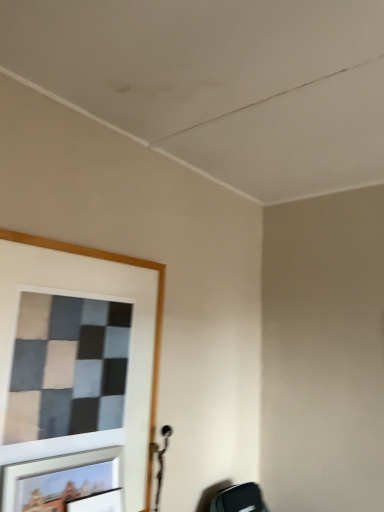
What do you see at coordinates (98, 502) in the screenshot? I see `matte black picture frame at lower left, which is counted as the 1th picture frame, starting from the bottom` at bounding box center [98, 502].

At what (x,y) coordinates should I click in order to perform the action: click on matte black picture frame at lower left, which is the second picture frame in top-to-bottom order. Please return your answer as a coordinate pair (x, y). Looking at the image, I should click on (98, 502).

This screenshot has width=384, height=512. Describe the element at coordinates (60, 480) in the screenshot. I see `metallic silver picture frame at lower left, marked as the 1th picture frame in a top-to-bottom arrangement` at that location.

What are the coordinates of `metallic silver picture frame at lower left, which is the second picture frame in bottom-to-top order` in the screenshot? It's located at (60, 480).

Locate an element on the screen. matte black picture frame at lower left, which is counted as the 1th picture frame, starting from the bottom is located at coordinates (x=98, y=502).

Is metallic silver picture frame at lower left, which is the second picture frame in bottom-to-top order, at the left side of matte black picture frame at lower left, which is the second picture frame in top-to-bottom order?

Indeed, metallic silver picture frame at lower left, which is the second picture frame in bottom-to-top order, is positioned on the left side of matte black picture frame at lower left, which is the second picture frame in top-to-bottom order.

Which is behind, metallic silver picture frame at lower left, which is the second picture frame in bottom-to-top order, or matte black picture frame at lower left, which is the second picture frame in top-to-bottom order?

Positioned behind is matte black picture frame at lower left, which is the second picture frame in top-to-bottom order.

Is point (31, 478) more distant than point (121, 495)?

No, it is in front of (121, 495).

From the image's perspective, is metallic silver picture frame at lower left, marked as the 1th picture frame in a top-to-bottom arrangement, below matte black picture frame at lower left, which is the second picture frame in top-to-bottom order?

No.

From a real-world perspective, does metallic silver picture frame at lower left, marked as the 1th picture frame in a top-to-bottom arrangement, stand above matte black picture frame at lower left, which is counted as the 1th picture frame, starting from the bottom?

Yes, from a real-world perspective, metallic silver picture frame at lower left, marked as the 1th picture frame in a top-to-bottom arrangement, is over matte black picture frame at lower left, which is counted as the 1th picture frame, starting from the bottom

Is metallic silver picture frame at lower left, which is the second picture frame in bottom-to-top order, thinner than matte black picture frame at lower left, which is counted as the 1th picture frame, starting from the bottom?

Indeed, metallic silver picture frame at lower left, which is the second picture frame in bottom-to-top order, has a lesser width compared to matte black picture frame at lower left, which is counted as the 1th picture frame, starting from the bottom.

Between metallic silver picture frame at lower left, marked as the 1th picture frame in a top-to-bottom arrangement, and matte black picture frame at lower left, which is counted as the 1th picture frame, starting from the bottom, which one has more height?

Standing taller between the two is metallic silver picture frame at lower left, marked as the 1th picture frame in a top-to-bottom arrangement.

Is metallic silver picture frame at lower left, marked as the 1th picture frame in a top-to-bottom arrangement, bigger or smaller than matte black picture frame at lower left, which is counted as the 1th picture frame, starting from the bottom?

In the image, metallic silver picture frame at lower left, marked as the 1th picture frame in a top-to-bottom arrangement, appears to be larger than matte black picture frame at lower left, which is counted as the 1th picture frame, starting from the bottom.

Is metallic silver picture frame at lower left, marked as the 1th picture frame in a top-to-bottom arrangement, inside or outside of matte black picture frame at lower left, which is the second picture frame in top-to-bottom order?

metallic silver picture frame at lower left, marked as the 1th picture frame in a top-to-bottom arrangement, is located beyond the bounds of matte black picture frame at lower left, which is the second picture frame in top-to-bottom order.

Is metallic silver picture frame at lower left, marked as the 1th picture frame in a top-to-bottom arrangement, not close to matte black picture frame at lower left, which is counted as the 1th picture frame, starting from the bottom?

metallic silver picture frame at lower left, marked as the 1th picture frame in a top-to-bottom arrangement, is actually quite close to matte black picture frame at lower left, which is counted as the 1th picture frame, starting from the bottom.

Is metallic silver picture frame at lower left, marked as the 1th picture frame in a top-to-bottom arrangement, turned away from matte black picture frame at lower left, which is the second picture frame in top-to-bottom order?

No, metallic silver picture frame at lower left, marked as the 1th picture frame in a top-to-bottom arrangement, is not facing the opposite direction of matte black picture frame at lower left, which is the second picture frame in top-to-bottom order.

Consider the image. Can you tell me how much metallic silver picture frame at lower left, marked as the 1th picture frame in a top-to-bottom arrangement, and matte black picture frame at lower left, which is the second picture frame in top-to-bottom order, differ in facing direction?

The facing directions of metallic silver picture frame at lower left, marked as the 1th picture frame in a top-to-bottom arrangement, and matte black picture frame at lower left, which is the second picture frame in top-to-bottom order, are 0.006 degrees apart.

Locate an element on the screen. This screenshot has width=384, height=512. picture frame located in front of the matte black picture frame at lower left, which is counted as the 1th picture frame, starting from the bottom is located at coordinates (60, 480).

Considering the positions of objects matte black picture frame at lower left, which is counted as the 1th picture frame, starting from the bottom, and metallic silver picture frame at lower left, marked as the 1th picture frame in a top-to-bottom arrangement, in the image provided, who is more to the right, matte black picture frame at lower left, which is counted as the 1th picture frame, starting from the bottom, or metallic silver picture frame at lower left, marked as the 1th picture frame in a top-to-bottom arrangement,?

From the viewer's perspective, matte black picture frame at lower left, which is counted as the 1th picture frame, starting from the bottom, appears more on the right side.

Is the position of matte black picture frame at lower left, which is the second picture frame in top-to-bottom order, less distant than that of metallic silver picture frame at lower left, marked as the 1th picture frame in a top-to-bottom arrangement?

No, matte black picture frame at lower left, which is the second picture frame in top-to-bottom order, is further to the viewer.

Is point (117, 490) more distant than point (22, 472)?

Yes, point (117, 490) is farther from viewer.

From the image's perspective, is matte black picture frame at lower left, which is the second picture frame in top-to-bottom order, positioned above or below metallic silver picture frame at lower left, which is the second picture frame in bottom-to-top order?

Based on their image positions, matte black picture frame at lower left, which is the second picture frame in top-to-bottom order, is located beneath metallic silver picture frame at lower left, which is the second picture frame in bottom-to-top order.

Looking at this image, from a real-world perspective, is matte black picture frame at lower left, which is counted as the 1th picture frame, starting from the bottom, physically located above or below metallic silver picture frame at lower left, which is the second picture frame in bottom-to-top order?

In terms of real-world spatial position, matte black picture frame at lower left, which is counted as the 1th picture frame, starting from the bottom, is below metallic silver picture frame at lower left, which is the second picture frame in bottom-to-top order.

Between matte black picture frame at lower left, which is the second picture frame in top-to-bottom order, and metallic silver picture frame at lower left, which is the second picture frame in bottom-to-top order, which one has larger width?

With larger width is matte black picture frame at lower left, which is the second picture frame in top-to-bottom order.

Who is shorter, matte black picture frame at lower left, which is counted as the 1th picture frame, starting from the bottom, or metallic silver picture frame at lower left, marked as the 1th picture frame in a top-to-bottom arrangement?

With less height is matte black picture frame at lower left, which is counted as the 1th picture frame, starting from the bottom.

Based on their sizes in the image, would you say matte black picture frame at lower left, which is counted as the 1th picture frame, starting from the bottom, is bigger or smaller than metallic silver picture frame at lower left, which is the second picture frame in bottom-to-top order?

Considering their sizes, matte black picture frame at lower left, which is counted as the 1th picture frame, starting from the bottom, takes up less space than metallic silver picture frame at lower left, which is the second picture frame in bottom-to-top order.

Would you say matte black picture frame at lower left, which is the second picture frame in top-to-bottom order, contains metallic silver picture frame at lower left, which is the second picture frame in bottom-to-top order?

No, metallic silver picture frame at lower left, which is the second picture frame in bottom-to-top order, is located outside of matte black picture frame at lower left, which is the second picture frame in top-to-bottom order.

Are matte black picture frame at lower left, which is the second picture frame in top-to-bottom order, and metallic silver picture frame at lower left, which is the second picture frame in bottom-to-top order, making contact?

Yes, matte black picture frame at lower left, which is the second picture frame in top-to-bottom order, is touching metallic silver picture frame at lower left, which is the second picture frame in bottom-to-top order.

Could you tell me if matte black picture frame at lower left, which is the second picture frame in top-to-bottom order, is turned towards metallic silver picture frame at lower left, marked as the 1th picture frame in a top-to-bottom arrangement?

No, matte black picture frame at lower left, which is the second picture frame in top-to-bottom order, is not facing towards metallic silver picture frame at lower left, marked as the 1th picture frame in a top-to-bottom arrangement.

Can you tell me how much matte black picture frame at lower left, which is the second picture frame in top-to-bottom order, and metallic silver picture frame at lower left, which is the second picture frame in bottom-to-top order, differ in facing direction?

The angle between the facing direction of matte black picture frame at lower left, which is the second picture frame in top-to-bottom order, and the facing direction of metallic silver picture frame at lower left, which is the second picture frame in bottom-to-top order, is 0.006 degrees.

The width and height of the screenshot is (384, 512). I want to click on picture frame above the matte black picture frame at lower left, which is the second picture frame in top-to-bottom order (from a real-world perspective), so click(60, 480).

Locate an element on the screen. This screenshot has height=512, width=384. picture frame above the matte black picture frame at lower left, which is counted as the 1th picture frame, starting from the bottom (from the image's perspective) is located at coordinates (60, 480).

I want to click on picture frame in front of the matte black picture frame at lower left, which is counted as the 1th picture frame, starting from the bottom, so click(x=60, y=480).